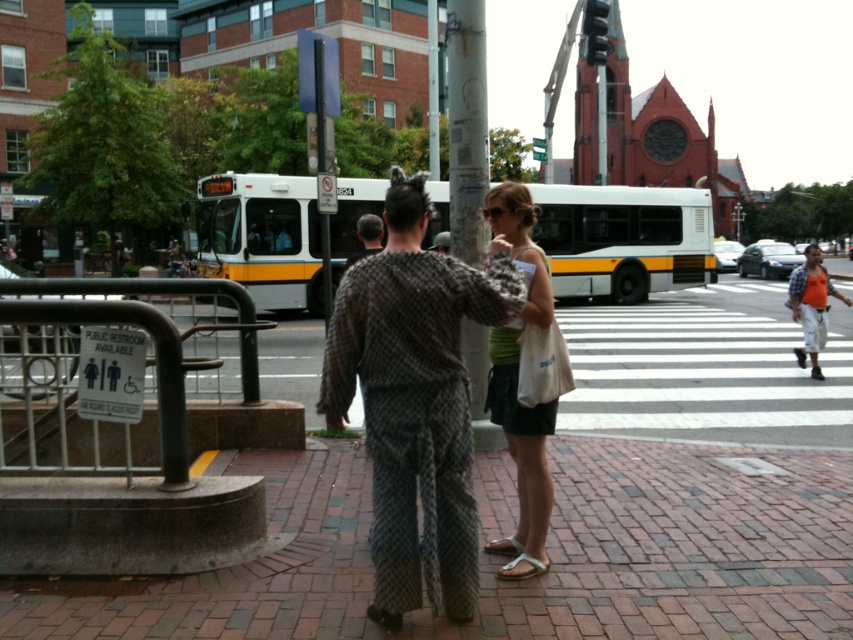
Question: Does white/yellow bus at center have a smaller size compared to dark gray textured shirt at center?

Choices:
 (A) yes
 (B) no

Answer: (B)

Question: Is the position of brick pavement at center less distant than that of concrete sign at lower left?

Choices:
 (A) yes
 (B) no

Answer: (A)

Question: Estimate the real-world distances between objects in this image. Which object is closer to the concrete sign at lower left?

Choices:
 (A) brick pavement at center
 (B) green jersey at center
 (C) smooth gray pole at center

Answer: (C)

Question: Considering the real-world distances, which object is farthest from the orange t-shirt at center?

Choices:
 (A) dark gray textured shirt at center
 (B) concrete sign at lower left
 (C) white/yellow bus at center
 (D) brick pavement at center

Answer: (B)

Question: Observing the image, what is the correct spatial positioning of white/yellow bus at center in reference to smooth gray pole at center?

Choices:
 (A) right
 (B) left

Answer: (A)

Question: Which point appears farthest from the camera in this image?

Choices:
 (A) (326, 388)
 (B) (196, 467)
 (C) (798, 320)
 (D) (467, 104)

Answer: (C)